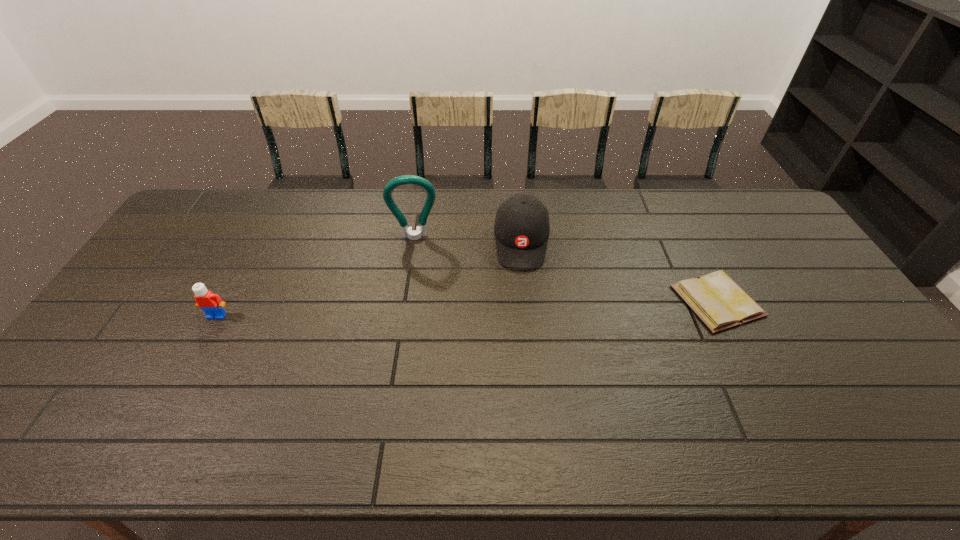
Locate an element on the screen. This screenshot has height=540, width=960. free space between the rightmost object and the baseball cap is located at coordinates (619, 272).

This screenshot has width=960, height=540. I want to click on vacant space in between the tallest object and the baseball cap, so click(468, 240).

Image resolution: width=960 pixels, height=540 pixels. Find the location of `vacant area between the leftmost object and the second object from right to left`. vacant area between the leftmost object and the second object from right to left is located at coordinates (370, 279).

Where is `empty space between the leftmost object and the diary`? empty space between the leftmost object and the diary is located at coordinates (467, 308).

The width and height of the screenshot is (960, 540). In order to click on vacant point located between the rightmost object and the third object from left to right in this screenshot , I will do `click(619, 272)`.

Find the location of `free area in between the Lego and the diary`. free area in between the Lego and the diary is located at coordinates (467, 308).

Where is `free space between the diary and the leftmost object`? The width and height of the screenshot is (960, 540). free space between the diary and the leftmost object is located at coordinates (467, 308).

Locate an element on the screen. This screenshot has height=540, width=960. vacant area between the bottle opener and the diary is located at coordinates (565, 269).

This screenshot has width=960, height=540. Find the location of `free point between the leftmost object and the baseball cap`. free point between the leftmost object and the baseball cap is located at coordinates (370, 279).

The image size is (960, 540). Identify the location of vacant point located between the rightmost object and the leftmost object. pyautogui.click(x=467, y=308).